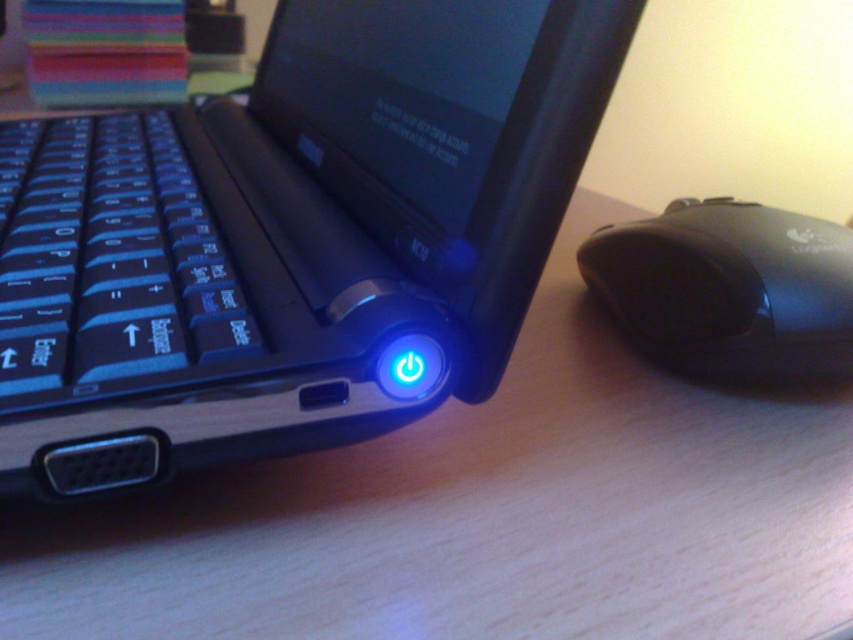
Question: Which is nearer to the blue glossy power button at center?

Choices:
 (A) black plastic mouse at right
 (B) blue matte keyboard at left

Answer: (B)

Question: Observing the image, what is the correct spatial positioning of blue glossy power button at center in reference to black plastic mouse at right?

Choices:
 (A) right
 (B) left

Answer: (B)

Question: Among these objects, which one is farthest from the camera?

Choices:
 (A) black plastic mouse at right
 (B) blue glossy power button at center

Answer: (A)

Question: Among these objects, which one is farthest from the camera?

Choices:
 (A) black plastic mouse at right
 (B) blue glossy power button at center

Answer: (A)

Question: Considering the relative positions of blue glossy power button at center and blue matte keyboard at left in the image provided, where is blue glossy power button at center located with respect to blue matte keyboard at left?

Choices:
 (A) left
 (B) right

Answer: (B)

Question: Does blue glossy power button at center have a lesser width compared to black plastic mouse at right?

Choices:
 (A) yes
 (B) no

Answer: (B)